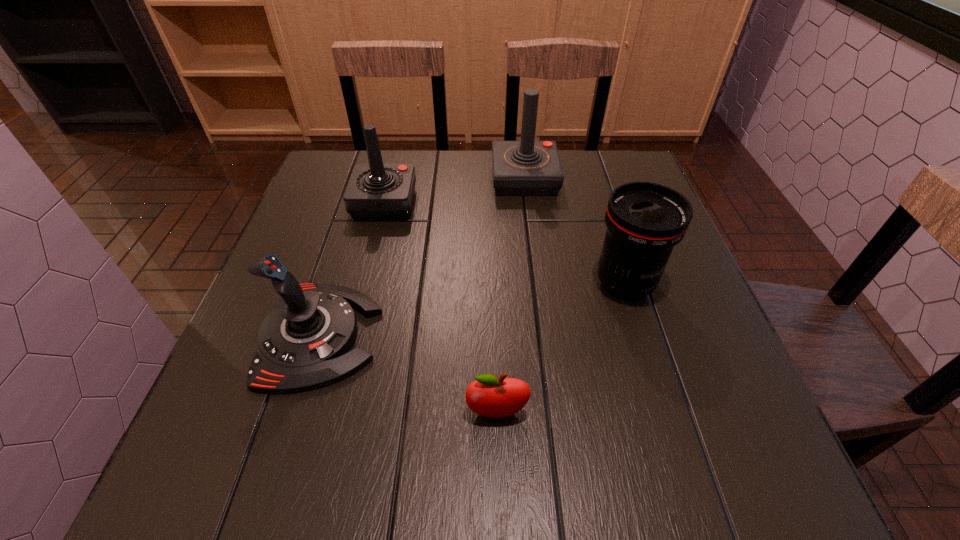
The image size is (960, 540). Find the location of `free space located on the right of the nearest object`. free space located on the right of the nearest object is located at coordinates (570, 413).

You are a GUI agent. You are given a task and a screenshot of the screen. Output one action in this format:
    pyautogui.click(x=<x>, y=<y>)
    Task: Click on the object that is at the right edge
    The width and height of the screenshot is (960, 540).
    Given the screenshot: What is the action you would take?
    pyautogui.click(x=644, y=220)

Where is `object that is at the far left corner`? The height and width of the screenshot is (540, 960). object that is at the far left corner is located at coordinates (374, 191).

In the image, there is a desktop. In order to click on vacant space at the far edge in this screenshot , I will do click(386, 163).

The image size is (960, 540). In order to click on vacant space at the near edge of the desktop in this screenshot , I will do `click(372, 436)`.

Identify the location of vacant space at the left edge. click(x=358, y=224).

Where is `vacant region at the right edge of the desktop`? The height and width of the screenshot is (540, 960). vacant region at the right edge of the desktop is located at coordinates (650, 333).

Find the location of a particular element. The image size is (960, 540). free region at the far right corner is located at coordinates (598, 179).

Image resolution: width=960 pixels, height=540 pixels. I want to click on vacant position at the near right corner of the desktop, so click(731, 488).

Where is `free space between the rightmost object and the apple`? This screenshot has height=540, width=960. free space between the rightmost object and the apple is located at coordinates (561, 348).